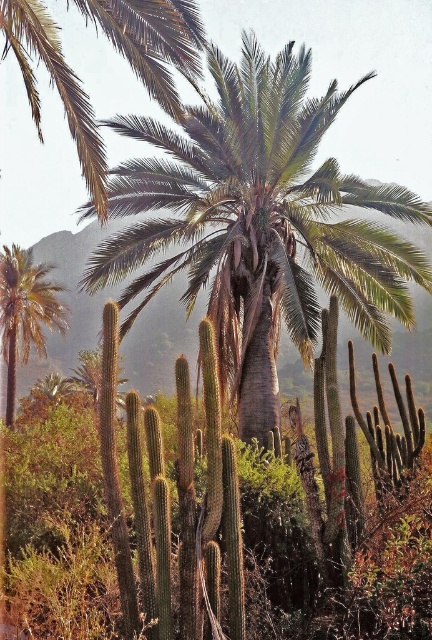
Which of these two, green leafy palm at upper center or green leafy palm at left, stands shorter?

green leafy palm at left is shorter.

Does green leafy palm at upper center have a greater height compared to green leafy palm at left?

Correct, green leafy palm at upper center is much taller as green leafy palm at left.

Where is `green leafy palm at upper center`? The image size is (432, 640). green leafy palm at upper center is located at coordinates (152, 40).

The height and width of the screenshot is (640, 432). Identify the location of green leafy palm at upper center. (152, 40).

What are the coordinates of `green spiny cactus at center` in the screenshot? It's located at (207, 504).

Which of these two, green spiny cactus at center or green leafy palm at upper center, stands shorter?

green spiny cactus at center

Is point (155, 499) positioned after point (85, 138)?

No, it is in front of (85, 138).

At what (x,y) coordinates should I click in order to perform the action: click on green spiny cactus at center. Please return your answer as a coordinate pair (x, y). Looking at the image, I should click on (207, 504).

Who is shorter, green leafy palm at center or green leafy palm at left?

green leafy palm at center is shorter.

Can you confirm if green leafy palm at center is positioned above green leafy palm at left?

Indeed, green leafy palm at center is positioned over green leafy palm at left.

The image size is (432, 640). Describe the element at coordinates (259, 221) in the screenshot. I see `green leafy palm at center` at that location.

Where is `green leafy palm at center`? green leafy palm at center is located at coordinates (259, 221).